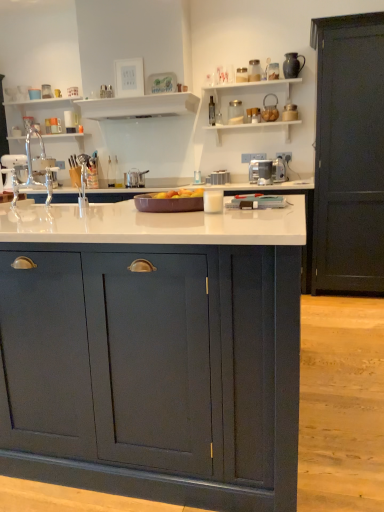
What do you see at coordinates (219, 177) in the screenshot? I see `metallic silver toaster at center, positioned as the 2th appliance in left-to-right order` at bounding box center [219, 177].

Locate an element on the screen. Image resolution: width=384 pixels, height=512 pixels. matte dark blue cabinet at center, the 2th cabinetry when ordered from back to front is located at coordinates click(177, 354).

Where is `transparent glass bottle at upper center`? The width and height of the screenshot is (384, 512). transparent glass bottle at upper center is located at coordinates (212, 112).

The image size is (384, 512). Identify the location of satin silver toaster at center, which ranks as the third appliance in back-to-front order. (260, 170).

The height and width of the screenshot is (512, 384). I want to click on dark wood door at right, which is counted as the 1th cabinetry, starting from the right, so [x=349, y=154].

How much space does dark wood door at right, which is counted as the 1th cabinetry, starting from the right, occupy horizontally?

dark wood door at right, which is counted as the 1th cabinetry, starting from the right, is 29.09 inches wide.

From the picture: What is the approximate width of white glossy shelf at upper center, which is counted as the 1th shelf, starting from the right?

white glossy shelf at upper center, which is counted as the 1th shelf, starting from the right, is 15.86 inches in width.

At what (x,y) coordinates should I click in order to perform the action: click on white glossy shelves at upper left, which is the second shelf from right to left. Please return your answer as a coordinate pair (x, y). The width and height of the screenshot is (384, 512). Looking at the image, I should click on (41, 109).

Is point (212, 98) in front of point (106, 456)?

No.

In order to click on bottle above the matte dark blue cabinet at center, the 2th cabinetry when ordered from back to front (from the image's perspective) in this screenshot , I will do `click(212, 112)`.

Considering the positions of objects transparent glass bottle at upper center and matte dark blue cabinet at center, the second cabinetry positioned from the right, in the image provided, who is in front, transparent glass bottle at upper center or matte dark blue cabinet at center, the second cabinetry positioned from the right,?

matte dark blue cabinet at center, the second cabinetry positioned from the right, is in front.

Is matte dark blue cabinet at center, the 2th cabinetry when ordered from back to front, at the back of transparent glass bottle at upper center?

No, transparent glass bottle at upper center's orientation is not away from matte dark blue cabinet at center, the 2th cabinetry when ordered from back to front.

From a real-world perspective, does satin silver pot at center, acting as the 2th appliance starting from the front, stand above white glossy shelves at upper left, which is the first shelf in left-to-right order?

Actually, satin silver pot at center, acting as the 2th appliance starting from the front, is physically below white glossy shelves at upper left, which is the first shelf in left-to-right order, in the real world.

Is white glossy shelves at upper left, which is the first shelf in left-to-right order, inside satin silver pot at center, arranged as the second appliance when viewed from the back?

No, white glossy shelves at upper left, which is the first shelf in left-to-right order, is located outside of satin silver pot at center, arranged as the second appliance when viewed from the back.

Does point (136, 175) come in front of point (37, 109)?

Yes, it is in front of point (37, 109).

Is satin silver pot at center, which appears as the 3th appliance when viewed from the right, oriented away from white glossy shelves at upper left, which is the second shelf from right to left?

That's not correct — satin silver pot at center, which appears as the 3th appliance when viewed from the right, is not looking away from white glossy shelves at upper left, which is the second shelf from right to left.

From the image's perspective, which object appears higher, dark wood door at right, the 2th cabinetry from the front, or satin silver toaster at center, the 1th appliance positioned from the front?

dark wood door at right, the 2th cabinetry from the front, appears higher in the image.

Does dark wood door at right, the 2th cabinetry from the front, have a greater height compared to satin silver toaster at center, the 1th appliance positioned from the front?

Indeed, dark wood door at right, the 2th cabinetry from the front, has a greater height compared to satin silver toaster at center, the 1th appliance positioned from the front.

Considering the sizes of dark wood door at right, the second cabinetry positioned from the left, and satin silver toaster at center, marked as the third appliance in a left-to-right arrangement, in the image, is dark wood door at right, the second cabinetry positioned from the left, wider or thinner than satin silver toaster at center, marked as the third appliance in a left-to-right arrangement,?

dark wood door at right, the second cabinetry positioned from the left, is wider than satin silver toaster at center, marked as the third appliance in a left-to-right arrangement.

In terms of size, does dark wood door at right, which is counted as the 1th cabinetry, starting from the right, appear bigger or smaller than satin silver toaster at center, the 1th appliance positioned from the front?

dark wood door at right, which is counted as the 1th cabinetry, starting from the right, is bigger than satin silver toaster at center, the 1th appliance positioned from the front.

Can you confirm if satin silver toaster at center, the 1th appliance positioned from the front, is thinner than white glossy shelf at upper center, which is counted as the 1th shelf, starting from the right?

Indeed, satin silver toaster at center, the 1th appliance positioned from the front, has a lesser width compared to white glossy shelf at upper center, which is counted as the 1th shelf, starting from the right.

From the image's perspective, is satin silver toaster at center, marked as the third appliance in a left-to-right arrangement, over white glossy shelf at upper center, marked as the 2th shelf in a left-to-right arrangement?

No, from the image's perspective, satin silver toaster at center, marked as the third appliance in a left-to-right arrangement, is not above white glossy shelf at upper center, marked as the 2th shelf in a left-to-right arrangement.

From a real-world perspective, between satin silver toaster at center, which ranks as the third appliance in back-to-front order, and white glossy shelf at upper center, which is counted as the 1th shelf, starting from the right, who is vertically lower?

satin silver toaster at center, which ranks as the third appliance in back-to-front order.

Considering the positions of point (270, 179) and point (123, 116), is point (270, 179) closer or farther from the camera than point (123, 116)?

Point (270, 179).

Does point (262, 445) appear closer or farther from the camera than point (127, 178)?

Point (262, 445).

Consider the image. Is matte dark blue cabinet at center, the 2th cabinetry when ordered from back to front, oriented away from satin silver pot at center, arranged as the second appliance when viewed from the back?

Yes.

I want to click on cabinetry located below the satin silver pot at center, acting as the 1th appliance starting from the left (from the image's perspective), so click(x=177, y=354).

Between matte dark blue cabinet at center, the first cabinetry positioned from the left, and satin silver pot at center, acting as the 2th appliance starting from the front, which one appears on the right side from the viewer's perspective?

satin silver pot at center, acting as the 2th appliance starting from the front.

From their relative heights in the image, would you say satin silver pot at center, arranged as the second appliance when viewed from the back, is taller or shorter than satin silver toaster at center, which ranks as the third appliance in back-to-front order?

In the image, satin silver pot at center, arranged as the second appliance when viewed from the back, appears to be shorter than satin silver toaster at center, which ranks as the third appliance in back-to-front order.

Consider the image. From a real-world perspective, is satin silver pot at center, acting as the 2th appliance starting from the front, on satin silver toaster at center, which is the first appliance in right-to-left order?

No, from a real-world perspective, satin silver pot at center, acting as the 2th appliance starting from the front, is not on top of satin silver toaster at center, which is the first appliance in right-to-left order.

Is satin silver pot at center, which appears as the 3th appliance when viewed from the right, directly adjacent to satin silver toaster at center, marked as the third appliance in a left-to-right arrangement?

satin silver pot at center, which appears as the 3th appliance when viewed from the right, and satin silver toaster at center, marked as the third appliance in a left-to-right arrangement, are not in contact.

Is white glossy shelf at upper center, which is counted as the 1th shelf, starting from the right, facing towards matte dark blue cabinet at center, the first cabinetry positioned from the left?

No, white glossy shelf at upper center, which is counted as the 1th shelf, starting from the right, is not facing towards matte dark blue cabinet at center, the first cabinetry positioned from the left.

Can you tell me how much white glossy shelf at upper center, which is counted as the 1th shelf, starting from the right, and matte dark blue cabinet at center, the 2th cabinetry when ordered from back to front, differ in facing direction?

0.462 degrees separate the facing orientations of white glossy shelf at upper center, which is counted as the 1th shelf, starting from the right, and matte dark blue cabinet at center, the 2th cabinetry when ordered from back to front.

From a real-world perspective, which object rests below the other?

matte dark blue cabinet at center, the first cabinetry when ordered from front to back, is physically lower.

Is white glossy shelf at upper center, marked as the 2th shelf in a left-to-right arrangement, bigger than matte dark blue cabinet at center, the 2th cabinetry when ordered from back to front?

Actually, white glossy shelf at upper center, marked as the 2th shelf in a left-to-right arrangement, might be smaller than matte dark blue cabinet at center, the 2th cabinetry when ordered from back to front.

Find the location of a particular element. The height and width of the screenshot is (512, 384). cabinetry that is the 2nd one when counting forward from the transparent glass bottle at upper center is located at coordinates (177, 354).

This screenshot has height=512, width=384. Identify the location of the 2nd shelf to the left of the satin silver pot at center, which appears as the 3th appliance when viewed from the right, counting from the anchor's position. (41, 109).

From the image, which object appears to be nearer to white glossy shelf at upper center, which is counted as the 1th shelf, starting from the right, dark wood door at right, which is counted as the 1th cabinetry, starting from the right, or satin silver pot at center, arranged as the second appliance when viewed from the back?

satin silver pot at center, arranged as the second appliance when viewed from the back, is positioned closer to the anchor white glossy shelf at upper center, which is counted as the 1th shelf, starting from the right.

Considering their positions, is metallic silver toaster at center, placed as the first appliance when sorted from back to front, positioned closer to white glossy shelves at upper left, which is the first shelf in left-to-right order, than transparent glass bottle at upper center?

Among the two, transparent glass bottle at upper center is located nearer to white glossy shelves at upper left, which is the first shelf in left-to-right order.

Which object lies further to the anchor point satin silver pot at center, which appears as the 3th appliance when viewed from the right, transparent glass bottle at upper center or metallic silver toaster at center, positioned as the 2th appliance in left-to-right order?

The object further to satin silver pot at center, which appears as the 3th appliance when viewed from the right, is transparent glass bottle at upper center.

Estimate the real-world distances between objects in this image. Which object is further from white glossy shelf at upper center, marked as the 2th shelf in a left-to-right arrangement, matte dark blue cabinet at center, the first cabinetry when ordered from front to back, or white glossy shelves at upper left, which is the first shelf in left-to-right order?

matte dark blue cabinet at center, the first cabinetry when ordered from front to back, lies further to white glossy shelf at upper center, marked as the 2th shelf in a left-to-right arrangement, than the other object.

Considering their positions, is satin silver toaster at center, which ranks as the third appliance in back-to-front order, positioned closer to white glossy shelves at upper left, which is the first shelf in left-to-right order, than dark wood door at right, which appears as the first cabinetry when viewed from the back?

Based on the image, satin silver toaster at center, which ranks as the third appliance in back-to-front order, appears to be nearer to white glossy shelves at upper left, which is the first shelf in left-to-right order.

From the picture: When comparing their distances from matte dark blue cabinet at center, the 2th cabinetry when ordered from back to front, does dark wood door at right, the second cabinetry positioned from the left, or white glossy shelf at upper center, marked as the 2th shelf in a left-to-right arrangement, seem closer?

Based on the image, dark wood door at right, the second cabinetry positioned from the left, appears to be nearer to matte dark blue cabinet at center, the 2th cabinetry when ordered from back to front.

From the image, which object appears to be farther from metallic silver toaster at center, positioned as the 2th appliance in right-to-left order, transparent glass bottle at upper center or white glossy shelf at upper center, marked as the 2th shelf in a left-to-right arrangement?

Based on the image, white glossy shelf at upper center, marked as the 2th shelf in a left-to-right arrangement, appears to be further to metallic silver toaster at center, positioned as the 2th appliance in right-to-left order.

Which object lies nearer to the anchor point satin silver pot at center, acting as the 2th appliance starting from the front, white glossy shelf at upper center, marked as the 2th shelf in a left-to-right arrangement, or metallic silver toaster at center, positioned as the 2th appliance in left-to-right order?

white glossy shelf at upper center, marked as the 2th shelf in a left-to-right arrangement.

Locate an element on the screen. The height and width of the screenshot is (512, 384). bottle between satin silver pot at center, arranged as the second appliance when viewed from the back, and satin silver toaster at center, marked as the third appliance in a left-to-right arrangement, from left to right is located at coordinates (212, 112).

Find the location of a particular element. The height and width of the screenshot is (512, 384). shelf between white glossy shelves at upper left, which is the second shelf from right to left, and transparent glass bottle at upper center is located at coordinates (139, 106).

Identify the location of appliance between matte dark blue cabinet at center, the 2th cabinetry when ordered from back to front, and satin silver pot at center, which appears as the 3th appliance when viewed from the right, along the z-axis. The height and width of the screenshot is (512, 384). (260, 170).

Image resolution: width=384 pixels, height=512 pixels. In order to click on shelf between matte dark blue cabinet at center, the 2th cabinetry when ordered from back to front, and transparent glass bottle at upper center in the front-back direction in this screenshot , I will do `click(139, 106)`.